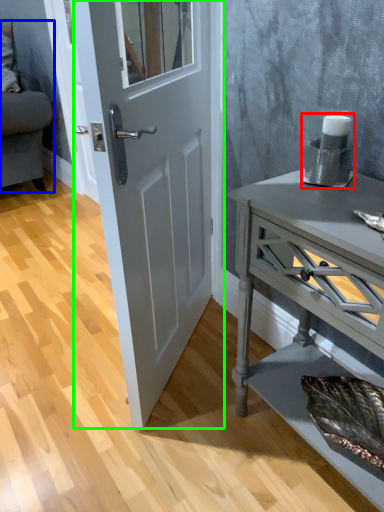
Question: Which object is positioned farthest from appliance (highlighted by a red box)? Select from studio couch (highlighted by a blue box) and door (highlighted by a green box).

Choices:
 (A) studio couch
 (B) door

Answer: (A)